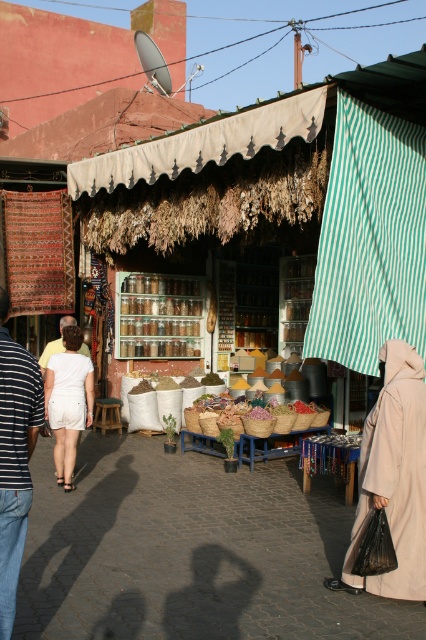
Question: Is blue striped shirt at left bigger than light brown leather jacket at center?

Choices:
 (A) yes
 (B) no

Answer: (A)

Question: Estimate the real-world distances between objects in this image. Which object is closer to the blue striped shirt at left?

Choices:
 (A) light brown leather jacket at center
 (B) white cotton shorts at center

Answer: (B)

Question: Which object appears farthest from the camera in this image?

Choices:
 (A) beige woolen abaya at lower right
 (B) blue striped shirt at left
 (C) white cotton shorts at center
 (D) light brown leather jacket at center

Answer: (D)

Question: Which object is farther from the camera taking this photo?

Choices:
 (A) light brown leather jacket at center
 (B) beige woolen abaya at lower right

Answer: (A)

Question: Can you confirm if white cotton shorts at center is wider than light brown leather jacket at center?

Choices:
 (A) yes
 (B) no

Answer: (A)

Question: Can you confirm if beige woolen abaya at lower right is smaller than light brown leather jacket at center?

Choices:
 (A) yes
 (B) no

Answer: (B)